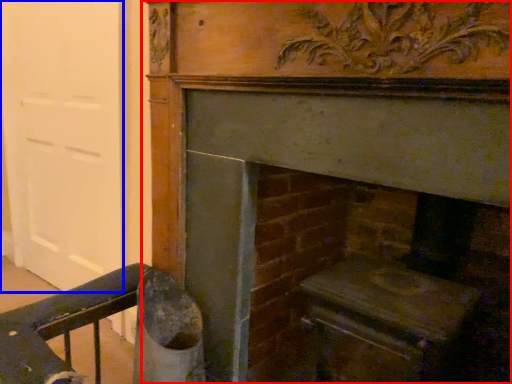
Question: Which of the following is the closest to the observer, fireplace (highlighted by a red box) or door (highlighted by a blue box)?

Choices:
 (A) fireplace
 (B) door

Answer: (A)